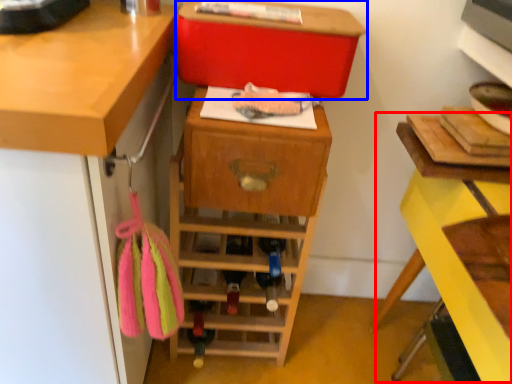
Question: Among these objects, which one is nearest to the camera, computer desk (highlighted by a red box) or storage box (highlighted by a blue box)?

Choices:
 (A) computer desk
 (B) storage box

Answer: (A)